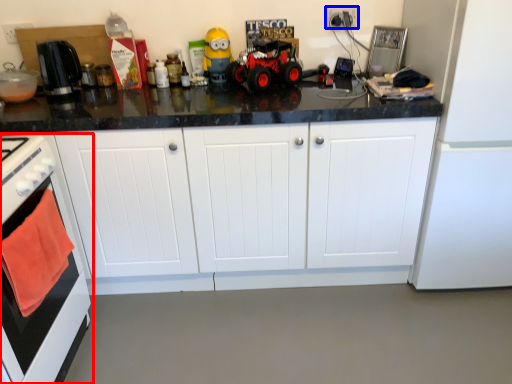
Question: Which object is further to the camera taking this photo, home appliance (highlighted by a red box) or electric outlet (highlighted by a blue box)?

Choices:
 (A) home appliance
 (B) electric outlet

Answer: (B)